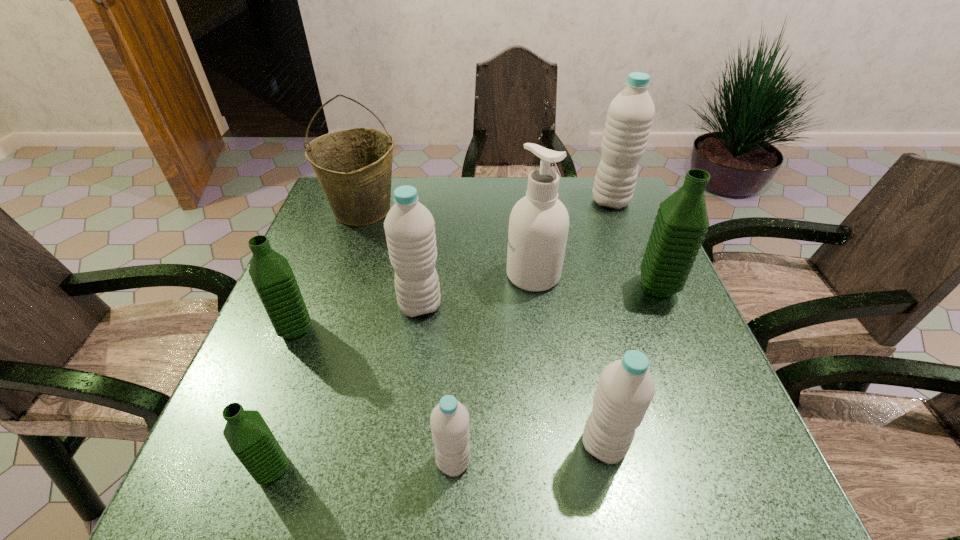
The width and height of the screenshot is (960, 540). Find the location of `vacant region located on the right of the second farthest white water bottle`. vacant region located on the right of the second farthest white water bottle is located at coordinates (494, 306).

Where is `vacant space located on the front of the second nearest green water bottle`? Image resolution: width=960 pixels, height=540 pixels. vacant space located on the front of the second nearest green water bottle is located at coordinates (240, 464).

The image size is (960, 540). I want to click on vacant region located on the back of the second smallest white water bottle, so (572, 296).

The width and height of the screenshot is (960, 540). In order to click on vacant space located 0.320m on the right of the fourth water bottle from right to left in this screenshot , I will do `click(663, 461)`.

Find the location of a particular element. vacant space located 0.150m on the right of the nearest green water bottle is located at coordinates (384, 469).

The height and width of the screenshot is (540, 960). Find the location of `water bottle positioned at the far edge`. water bottle positioned at the far edge is located at coordinates (630, 114).

In order to click on wine bucket present at the far edge in this screenshot , I will do (x=354, y=167).

Locate an element on the screen. wine bucket at the left edge is located at coordinates (354, 167).

The width and height of the screenshot is (960, 540). Identify the location of object that is at the far left corner. (354, 167).

The width and height of the screenshot is (960, 540). In order to click on object located in the near left corner section of the desktop in this screenshot , I will do `click(249, 437)`.